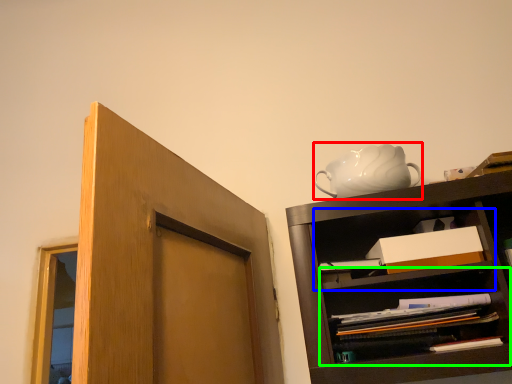
Question: Which object is positioned farthest from tea pot (highlighted by a red box)? Select from cabinet (highlighted by a blue box) and shelf (highlighted by a green box).

Choices:
 (A) cabinet
 (B) shelf

Answer: (B)